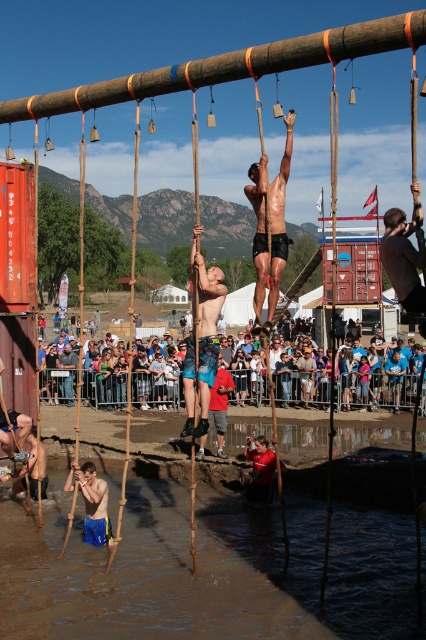
You are a photographer positioned at the edge of the obstacle course pit. You notice two participants wearing shiny metallic shorts at center and matte blue shorts at center. Which participant is higher up in the climb?

The shiny metallic shorts at center is above matte blue shorts at center, so the participant wearing shiny metallic shorts at center is higher up in the climb.

You are a participant in the obstacle course and need to cross the muddy water at lower center. The shiny metallic pole at center is nearby. Which one is closer to you as you stand at the starting line?

The muddy water at lower center is closer to you than the shiny metallic pole at center because it is smaller in size, indicating proximity.